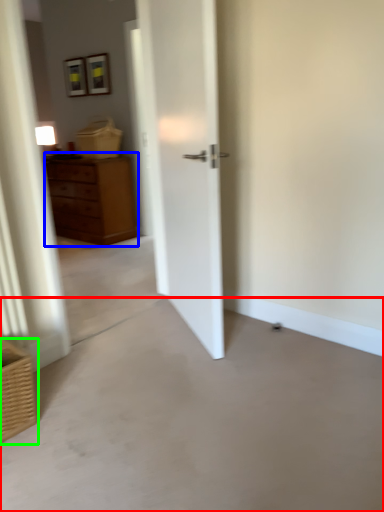
Question: Which object is positioned farthest from concrete (highlighted by a red box)? Select from chest of drawers (highlighted by a blue box) and basket (highlighted by a green box).

Choices:
 (A) chest of drawers
 (B) basket

Answer: (A)